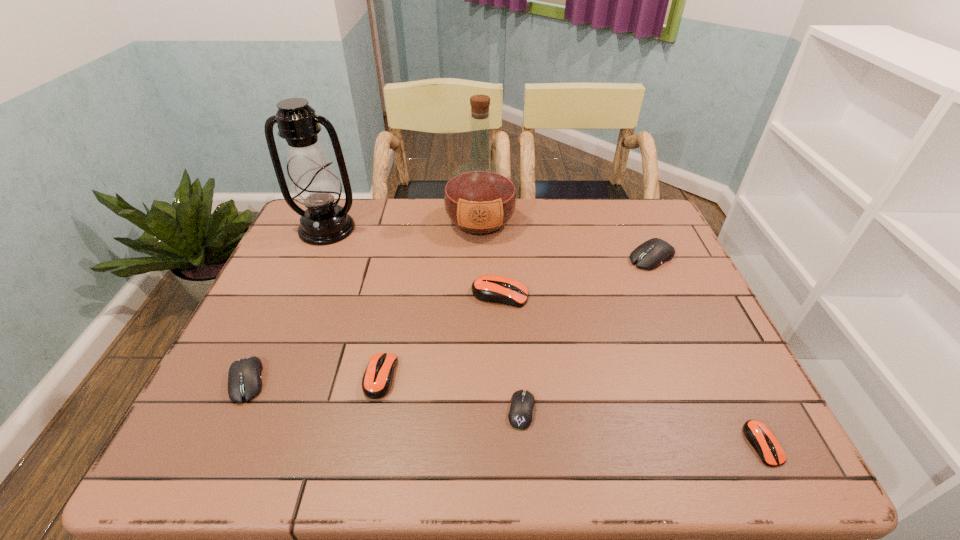
Locate an element on the screen. pink liquor is located at coordinates (480, 197).

Find the location of a particular element. The width and height of the screenshot is (960, 540). black oil lamp is located at coordinates (314, 184).

Find the location of a particular element. the biggest black computer equipment is located at coordinates (649, 255).

This screenshot has width=960, height=540. I want to click on the farthest computer mouse, so click(649, 255).

Where is `the fifth nearest object`? Image resolution: width=960 pixels, height=540 pixels. the fifth nearest object is located at coordinates (489, 288).

Image resolution: width=960 pixels, height=540 pixels. Find the location of `the farthest orange computer mouse`. the farthest orange computer mouse is located at coordinates (489, 288).

What are the coordinates of `the second smallest black computer equipment` in the screenshot? It's located at (244, 377).

Find the location of `the leftmost computer mouse`. the leftmost computer mouse is located at coordinates (244, 377).

The width and height of the screenshot is (960, 540). In order to click on the third object from left to right in this screenshot , I will do `click(377, 380)`.

Locate an element on the screen. the second nearest orange computer mouse is located at coordinates (377, 380).